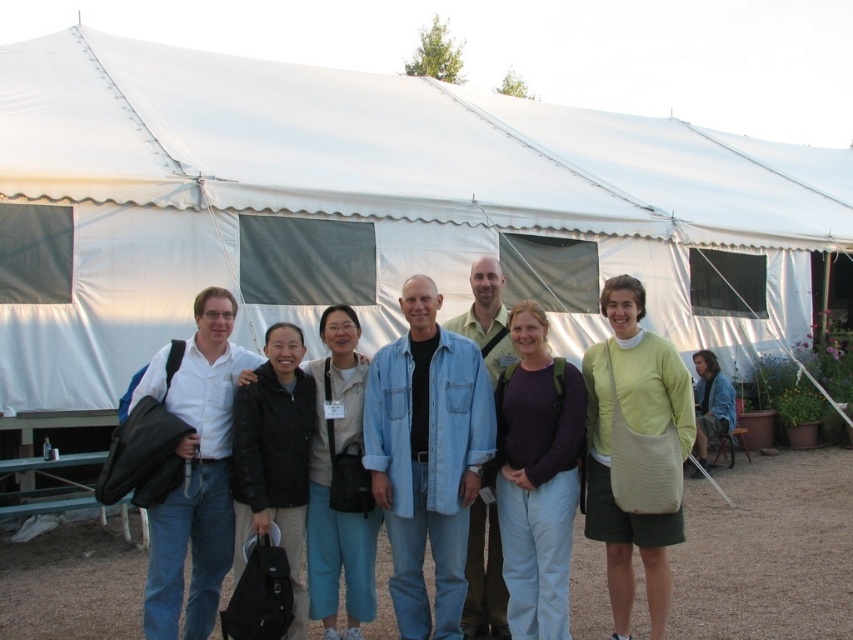
You are standing in front of the large white tent with dark windows and see the point marked at coordinates (537, 477). What object or person is located at that point?

The point at coordinates (537, 477) corresponds to the purple cotton shirt at center.

You are a photographer standing in front of the large white tent with dark windows. You notice a denim shirt at center and a light green woven bag at center in the scene. Which object is closer to you?

The denim shirt at center is closer to you because it is further to the viewer than the light green woven bag at center.

You are standing in front of the large white tent with dark windows and see the point at coordinates [642,435]. What object is located at that point?

The point at coordinates [642,435] corresponds to the denim jacket at center.